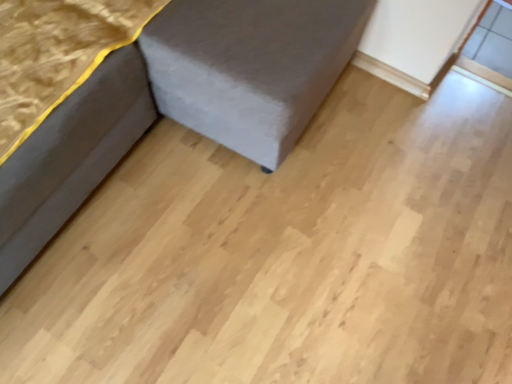
What is the approximate width of dark gray fabric at lower left, which appears as the 1th furniture when viewed from the left?

dark gray fabric at lower left, which appears as the 1th furniture when viewed from the left, is 28.85 inches wide.

This screenshot has height=384, width=512. What do you see at coordinates (75, 139) in the screenshot?
I see `dark gray fabric at lower left, which ranks as the second furniture in right-to-left order` at bounding box center [75, 139].

Where is `dark gray fabric at lower left, which appears as the 1th furniture when viewed from the left`? dark gray fabric at lower left, which appears as the 1th furniture when viewed from the left is located at coordinates (75, 139).

Image resolution: width=512 pixels, height=384 pixels. What do you see at coordinates (179, 102) in the screenshot?
I see `velvet grey sofa at lower left, placed as the first furniture when sorted from right to left` at bounding box center [179, 102].

Locate an element on the screen. The image size is (512, 384). velvet grey sofa at lower left, the 2th furniture viewed from the left is located at coordinates (179, 102).

Measure the distance between point (298, 57) and camera.

Point (298, 57) is 3.41 feet away from camera.

You are a GUI agent. You are given a task and a screenshot of the screen. Output one action in this format:
    pyautogui.click(x=<x>, y=<y>)
    Task: Click on the dark gray fabric at lower left, which ranks as the second furniture in right-to-left order
    
    Given the screenshot: What is the action you would take?
    pyautogui.click(x=75, y=139)

Considering the relative positions of velvet grey sofa at lower left, the 2th furniture viewed from the left, and dark gray fabric at lower left, which appears as the 1th furniture when viewed from the left, in the image provided, is velvet grey sofa at lower left, the 2th furniture viewed from the left, to the left or to the right of dark gray fabric at lower left, which appears as the 1th furniture when viewed from the left,?

Based on their positions, velvet grey sofa at lower left, the 2th furniture viewed from the left, is located to the right of dark gray fabric at lower left, which appears as the 1th furniture when viewed from the left.

Which object is closer to the camera, velvet grey sofa at lower left, the 2th furniture viewed from the left, or dark gray fabric at lower left, which ranks as the second furniture in right-to-left order?

velvet grey sofa at lower left, the 2th furniture viewed from the left, is closer to the camera.

Considering the points (258, 105) and (135, 96), which point is in front, point (258, 105) or point (135, 96)?

The point (258, 105) is closer to the camera.

From the picture: From the image's perspective, between velvet grey sofa at lower left, the 2th furniture viewed from the left, and dark gray fabric at lower left, which ranks as the second furniture in right-to-left order, who is located below?

dark gray fabric at lower left, which ranks as the second furniture in right-to-left order, from the image's perspective.

From a real-world perspective, is velvet grey sofa at lower left, placed as the first furniture when sorted from right to left, above or below dark gray fabric at lower left, which appears as the 1th furniture when viewed from the left?

velvet grey sofa at lower left, placed as the first furniture when sorted from right to left, is situated higher than dark gray fabric at lower left, which appears as the 1th furniture when viewed from the left, in the real world.

Considering the relative sizes of velvet grey sofa at lower left, the 2th furniture viewed from the left, and dark gray fabric at lower left, which appears as the 1th furniture when viewed from the left, in the image provided, is velvet grey sofa at lower left, the 2th furniture viewed from the left, thinner than dark gray fabric at lower left, which appears as the 1th furniture when viewed from the left,?

Incorrect, the width of velvet grey sofa at lower left, the 2th furniture viewed from the left, is not less than that of dark gray fabric at lower left, which appears as the 1th furniture when viewed from the left.

Considering the sizes of objects velvet grey sofa at lower left, the 2th furniture viewed from the left, and dark gray fabric at lower left, which appears as the 1th furniture when viewed from the left, in the image provided, who is taller, velvet grey sofa at lower left, the 2th furniture viewed from the left, or dark gray fabric at lower left, which appears as the 1th furniture when viewed from the left,?

velvet grey sofa at lower left, the 2th furniture viewed from the left, is taller.

Is velvet grey sofa at lower left, the 2th furniture viewed from the left, bigger than dark gray fabric at lower left, which ranks as the second furniture in right-to-left order?

Indeed, velvet grey sofa at lower left, the 2th furniture viewed from the left, has a larger size compared to dark gray fabric at lower left, which ranks as the second furniture in right-to-left order.

Would you say dark gray fabric at lower left, which ranks as the second furniture in right-to-left order, is part of velvet grey sofa at lower left, placed as the first furniture when sorted from right to left,'s contents?

Yes.

Is velvet grey sofa at lower left, the 2th furniture viewed from the left, far away from dark gray fabric at lower left, which appears as the 1th furniture when viewed from the left?

No, velvet grey sofa at lower left, the 2th furniture viewed from the left, is in close proximity to dark gray fabric at lower left, which appears as the 1th furniture when viewed from the left.

Could you tell me if velvet grey sofa at lower left, the 2th furniture viewed from the left, is turned towards dark gray fabric at lower left, which appears as the 1th furniture when viewed from the left?

Yes, velvet grey sofa at lower left, the 2th furniture viewed from the left, faces towards dark gray fabric at lower left, which appears as the 1th furniture when viewed from the left.

Measure the distance from velvet grey sofa at lower left, the 2th furniture viewed from the left, to dark gray fabric at lower left, which appears as the 1th furniture when viewed from the left.

The distance of velvet grey sofa at lower left, the 2th furniture viewed from the left, from dark gray fabric at lower left, which appears as the 1th furniture when viewed from the left, is 3.43 inches.

Image resolution: width=512 pixels, height=384 pixels. In order to click on furniture above the dark gray fabric at lower left, which ranks as the second furniture in right-to-left order (from a real-world perspective) in this screenshot , I will do `click(179, 102)`.

Is dark gray fabric at lower left, which appears as the 1th furniture when viewed from the left, to the left of velvet grey sofa at lower left, placed as the first furniture when sorted from right to left, from the viewer's perspective?

Yes.

Is the depth of dark gray fabric at lower left, which ranks as the second furniture in right-to-left order, less than that of velvet grey sofa at lower left, the 2th furniture viewed from the left?

No.

Which is behind, point (71, 104) or point (53, 180)?

The point (53, 180) is behind.

From the image's perspective, is dark gray fabric at lower left, which appears as the 1th furniture when viewed from the left, located above velvet grey sofa at lower left, the 2th furniture viewed from the left?

No, from the image's perspective, dark gray fabric at lower left, which appears as the 1th furniture when viewed from the left, is not over velvet grey sofa at lower left, the 2th furniture viewed from the left.

From a real-world perspective, who is located higher, dark gray fabric at lower left, which appears as the 1th furniture when viewed from the left, or velvet grey sofa at lower left, the 2th furniture viewed from the left?

velvet grey sofa at lower left, the 2th furniture viewed from the left, is physically above.

Considering the relative sizes of dark gray fabric at lower left, which ranks as the second furniture in right-to-left order, and velvet grey sofa at lower left, placed as the first furniture when sorted from right to left, in the image provided, is dark gray fabric at lower left, which ranks as the second furniture in right-to-left order, thinner than velvet grey sofa at lower left, placed as the first furniture when sorted from right to left,?

Correct, the width of dark gray fabric at lower left, which ranks as the second furniture in right-to-left order, is less than that of velvet grey sofa at lower left, placed as the first furniture when sorted from right to left.

Is dark gray fabric at lower left, which ranks as the second furniture in right-to-left order, shorter than velvet grey sofa at lower left, the 2th furniture viewed from the left?

Yes.

Considering the sizes of dark gray fabric at lower left, which ranks as the second furniture in right-to-left order, and velvet grey sofa at lower left, placed as the first furniture when sorted from right to left, in the image, is dark gray fabric at lower left, which ranks as the second furniture in right-to-left order, bigger or smaller than velvet grey sofa at lower left, placed as the first furniture when sorted from right to left,?

In the image, dark gray fabric at lower left, which ranks as the second furniture in right-to-left order, appears to be smaller than velvet grey sofa at lower left, placed as the first furniture when sorted from right to left.

Is velvet grey sofa at lower left, placed as the first furniture when sorted from right to left, completely or partially inside dark gray fabric at lower left, which appears as the 1th furniture when viewed from the left?

No.

Are dark gray fabric at lower left, which appears as the 1th furniture when viewed from the left, and velvet grey sofa at lower left, the 2th furniture viewed from the left, making contact?

Yes, dark gray fabric at lower left, which appears as the 1th furniture when viewed from the left, and velvet grey sofa at lower left, the 2th furniture viewed from the left, clearly make contact.

Is dark gray fabric at lower left, which ranks as the second furniture in right-to-left order, turned away from velvet grey sofa at lower left, placed as the first furniture when sorted from right to left?

Correct, dark gray fabric at lower left, which ranks as the second furniture in right-to-left order, is looking away from velvet grey sofa at lower left, placed as the first furniture when sorted from right to left.

Can you tell me how much dark gray fabric at lower left, which ranks as the second furniture in right-to-left order, and velvet grey sofa at lower left, placed as the first furniture when sorted from right to left, differ in facing direction?

The facing directions of dark gray fabric at lower left, which ranks as the second furniture in right-to-left order, and velvet grey sofa at lower left, placed as the first furniture when sorted from right to left, are 0.000138 degrees apart.

The width and height of the screenshot is (512, 384). Identify the location of furniture located on the left of velvet grey sofa at lower left, the 2th furniture viewed from the left. (75, 139).

Locate an element on the screen. This screenshot has height=384, width=512. furniture lying above the dark gray fabric at lower left, which appears as the 1th furniture when viewed from the left (from the image's perspective) is located at coordinates (179, 102).

At what (x,y) coordinates should I click in order to perform the action: click on furniture lying below the velvet grey sofa at lower left, placed as the first furniture when sorted from right to left (from the image's perspective). Please return your answer as a coordinate pair (x, y). The width and height of the screenshot is (512, 384). Looking at the image, I should click on (75, 139).